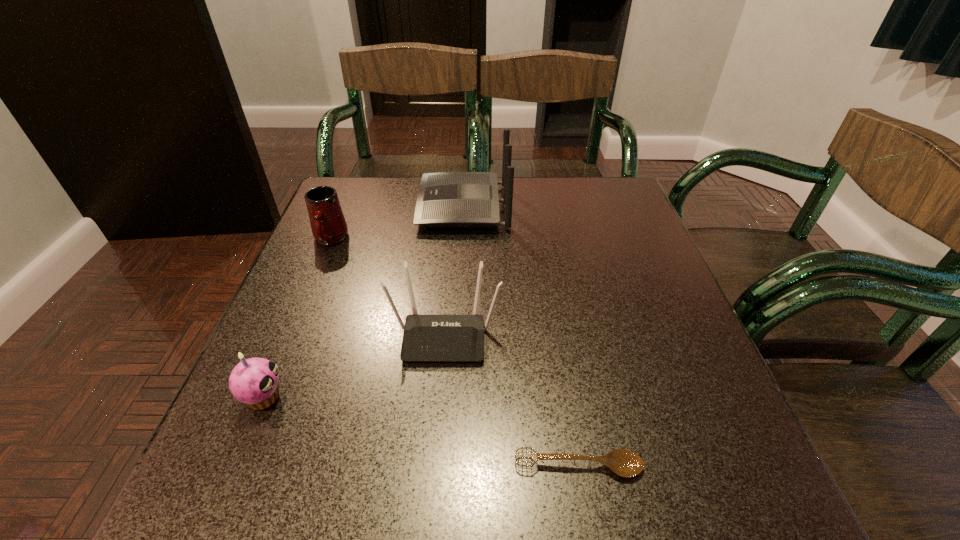
Locate an element on the screen. The height and width of the screenshot is (540, 960). the farther router is located at coordinates (445, 199).

Locate an element on the screen. the tallest object is located at coordinates (445, 199).

At what (x,y) coordinates should I click in order to perform the action: click on the shorter router. Please return your answer as a coordinate pair (x, y). Looking at the image, I should click on (426, 338).

Image resolution: width=960 pixels, height=540 pixels. I want to click on the third nearest object, so click(x=426, y=338).

Identify the location of mug. (328, 224).

This screenshot has width=960, height=540. I want to click on cupcake, so click(x=254, y=381).

You are a GUI agent. You are given a task and a screenshot of the screen. Output one action in this format:
    pyautogui.click(x=<x>, y=<y>)
    Task: Click on the shortest object
    This screenshot has width=960, height=540.
    Given the screenshot: What is the action you would take?
    pyautogui.click(x=625, y=463)

At what (x,y) coordinates should I click in order to perform the action: click on ladle. Please return your answer as a coordinate pair (x, y). This screenshot has width=960, height=540. Looking at the image, I should click on (625, 463).

The height and width of the screenshot is (540, 960). Identify the location of vacant space located 0.150m on the front-facing side of the tallest object. (363, 206).

Image resolution: width=960 pixels, height=540 pixels. Identify the location of free space located 0.050m on the front-facing side of the tallest object. (400, 206).